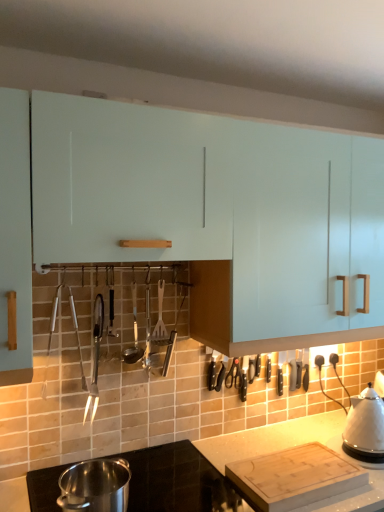
Question: Is white glossy cabinet at upper center positioned in front of polished stainless steel pot at lower left, the second kitchen appliance viewed from the right?

Choices:
 (A) no
 (B) yes

Answer: (B)

Question: Is white glossy cabinet at upper center smaller than polished stainless steel pot at lower left, the 2th kitchen appliance when ordered from back to front?

Choices:
 (A) yes
 (B) no

Answer: (B)

Question: From a real-world perspective, is white glossy cabinet at upper center beneath polished stainless steel pot at lower left, which is the first kitchen appliance in left-to-right order?

Choices:
 (A) yes
 (B) no

Answer: (B)

Question: Is white glossy cabinet at upper center to the left of polished stainless steel pot at lower left, which is counted as the first kitchen appliance, starting from the front, from the viewer's perspective?

Choices:
 (A) yes
 (B) no

Answer: (B)

Question: Does white glossy cabinet at upper center have a larger size compared to polished stainless steel pot at lower left, which is the first kitchen appliance in left-to-right order?

Choices:
 (A) no
 (B) yes

Answer: (B)

Question: Is white glossy cabinet at upper center outside of polished stainless steel pot at lower left, which is the first kitchen appliance in left-to-right order?

Choices:
 (A) no
 (B) yes

Answer: (B)

Question: Is shiny metallic tongs at center left, which is the 3th silverware in right-to-left order, to the left of wooden spatula at center, which is counted as the 1th silverware, starting from the right, from the viewer's perspective?

Choices:
 (A) yes
 (B) no

Answer: (A)

Question: Is shiny metallic tongs at center left, arranged as the first silverware when viewed from the left, closer to the viewer compared to wooden spatula at center, positioned as the third silverware in left-to-right order?

Choices:
 (A) no
 (B) yes

Answer: (B)

Question: From a real-world perspective, is shiny metallic tongs at center left, arranged as the first silverware when viewed from the left, on top of wooden spatula at center, which is counted as the 1th silverware, starting from the right?

Choices:
 (A) no
 (B) yes

Answer: (A)

Question: Is shiny metallic tongs at center left, which is the 3th silverware in right-to-left order, far from wooden spatula at center, which is counted as the 1th silverware, starting from the right?

Choices:
 (A) yes
 (B) no

Answer: (B)

Question: From the image's perspective, is shiny metallic tongs at center left, arranged as the first silverware when viewed from the left, located beneath wooden spatula at center, which is counted as the 1th silverware, starting from the right?

Choices:
 (A) no
 (B) yes

Answer: (B)

Question: Does shiny metallic tongs at center left, arranged as the first silverware when viewed from the left, have a lesser height compared to wooden spatula at center, positioned as the third silverware in left-to-right order?

Choices:
 (A) yes
 (B) no

Answer: (B)

Question: Can you confirm if polished stainless steel ladle at center, positioned as the second silverware in right-to-left order, is positioned to the right of smooth white countertop at lower center?

Choices:
 (A) no
 (B) yes

Answer: (A)